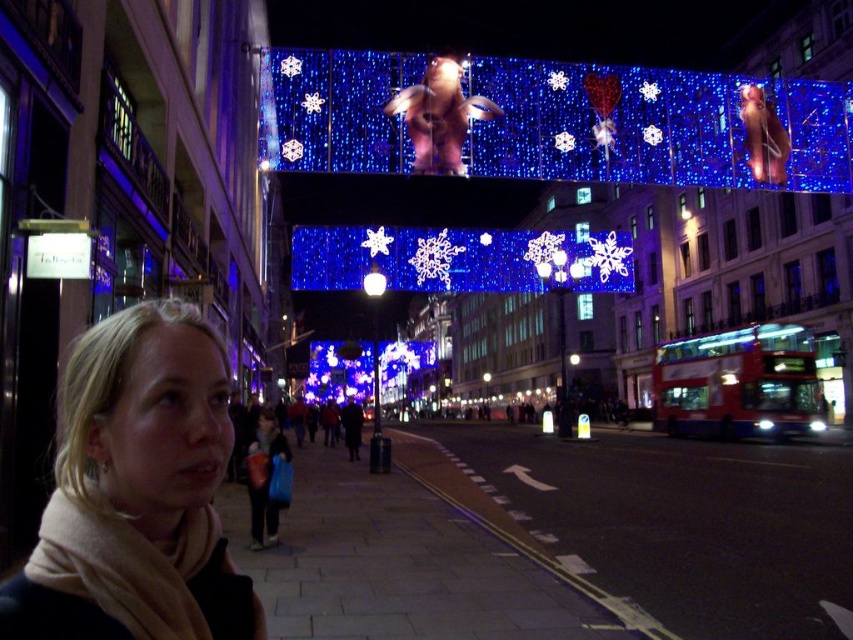
You are standing at the location of the woman in the scene and want to walk towards the archway. Which of the two points, point (x=689, y=154) or point (x=769, y=376), is closer to you?

Point (x=689, y=154) is in front of point (x=769, y=376), so it is closer to you.

You are standing in the festive urban scene and want to take a photo of the blonde hair at lower left and the red metallic bus at right. Which object should you frame first in your camera viewfinder to ensure both are in the shot?

You should frame the blonde hair at lower left first since it is positioned to the left of the red metallic bus at right, ensuring both are included in the photo.